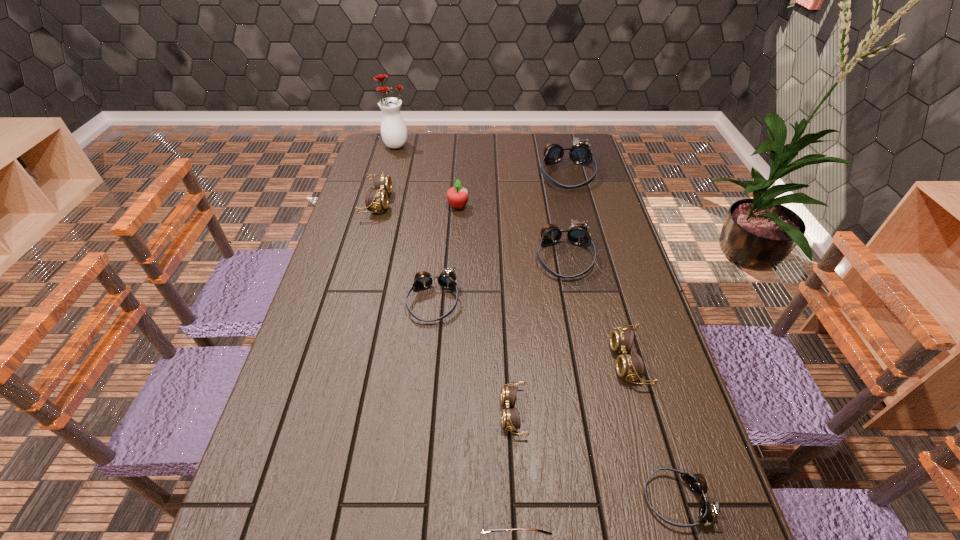
I want to click on goggles situated at the far edge, so tap(580, 153).

The height and width of the screenshot is (540, 960). Find the location of `vase present at the left edge`. vase present at the left edge is located at coordinates (x=393, y=129).

Identify the location of goggles located at the left edge. (377, 199).

Identify the location of object located in the far left corner section of the desktop. This screenshot has width=960, height=540. (393, 129).

You are a GUI agent. You are given a task and a screenshot of the screen. Output one action in this format:
    pyautogui.click(x=<x>, y=<y>)
    Task: Click on the object that is at the far right corner
    
    Given the screenshot: What is the action you would take?
    pyautogui.click(x=580, y=153)

Image resolution: width=960 pixels, height=540 pixels. I want to click on vacant space at the far edge, so click(x=505, y=162).

Find the location of `free spot at the left edge of the desktop`. free spot at the left edge of the desktop is located at coordinates (346, 332).

In the image, there is a desktop. Identify the location of vacant space at the right edge. This screenshot has height=540, width=960. (661, 435).

This screenshot has height=540, width=960. Find the location of `vacant area that lies between the rightmost brown goggles and the apple`. vacant area that lies between the rightmost brown goggles and the apple is located at coordinates (543, 284).

Locate an element on the screen. The width and height of the screenshot is (960, 540). empty location between the second brown goggles from right to left and the red apple is located at coordinates (486, 309).